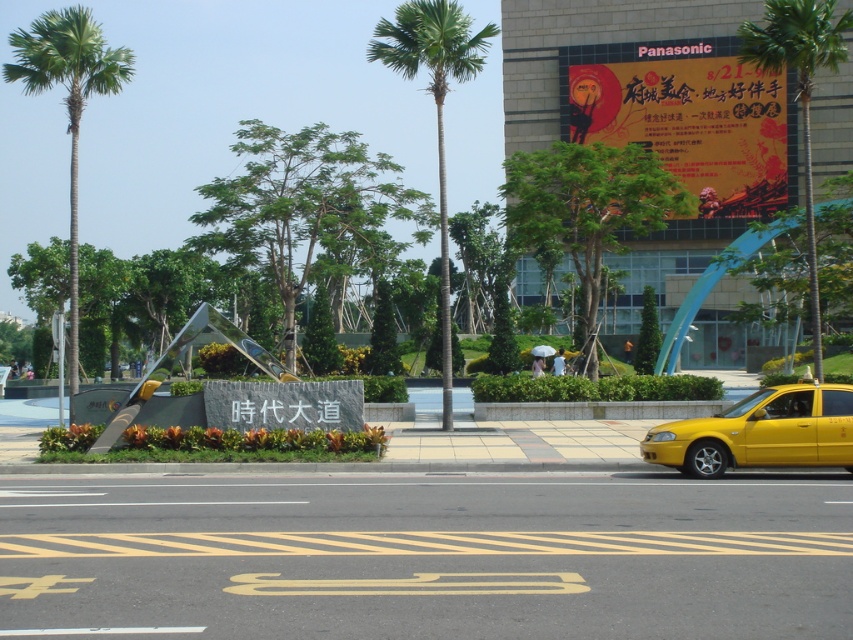
You are a delivery driver approaching the urban street scene. You need to locate the matte plastic billboard at upper center. According to the coordinates provided, where exactly is the matte plastic billboard located in the scene?

The matte plastic billboard at upper center is located at coordinates point (685, 116).

You are a city planner assessing the urban street scene. You need to determine if the matte plastic billboard at upper center will block the view of the green leafy palm tree at upper right from the road. Based on their heights, can the billboard obscure the palm tree?

The matte plastic billboard at upper center has a lesser height compared to green leafy palm tree at upper right. Since the billboard is shorter, it won